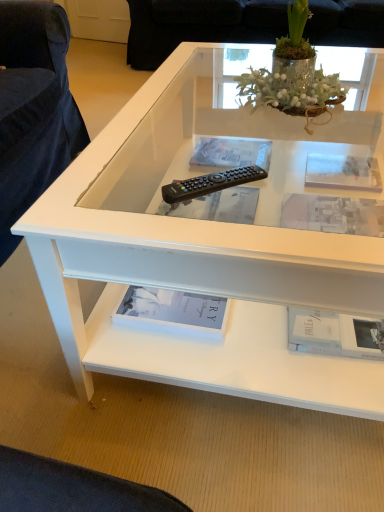
The height and width of the screenshot is (512, 384). What do you see at coordinates (232, 152) in the screenshot?
I see `clear plastic book at center, marked as the first book in a back-to-front arrangement` at bounding box center [232, 152].

The width and height of the screenshot is (384, 512). Describe the element at coordinates (198, 272) in the screenshot. I see `white glossy coffee table at center` at that location.

The height and width of the screenshot is (512, 384). What do you see at coordinates (343, 172) in the screenshot?
I see `transparent glass frame at upper center` at bounding box center [343, 172].

What do you see at coordinates (333, 214) in the screenshot?
I see `white matte book at upper right, positioned as the third book in back-to-front order` at bounding box center [333, 214].

Where is `white matte book at lower right, arranged as the 1th book when viewed from the front`? The image size is (384, 512). white matte book at lower right, arranged as the 1th book when viewed from the front is located at coordinates (334, 334).

Is clear plastic book at center, which is counted as the 5th book, starting from the front, inside the boundaries of matte black remote control at center, positioned as the 4th book in front-to-back order, or outside?

clear plastic book at center, which is counted as the 5th book, starting from the front, is not inside matte black remote control at center, positioned as the 4th book in front-to-back order, it's outside.

From the image's perspective, is clear plastic book at center, marked as the first book in a back-to-front arrangement, under matte black remote control at center, positioned as the 4th book in front-to-back order?

Actually, clear plastic book at center, marked as the first book in a back-to-front arrangement, appears above matte black remote control at center, positioned as the 4th book in front-to-back order, in the image.

Which object is wider, clear plastic book at center, which is counted as the 5th book, starting from the front, or matte black remote control at center, which is the second book in back-to-front order?

matte black remote control at center, which is the second book in back-to-front order, is wider.

From a real-world perspective, relative to matte black remote control at center, which is the second book in back-to-front order, is clear plastic book at center, marked as the first book in a back-to-front arrangement, vertically above or below?

From a real-world perspective, clear plastic book at center, marked as the first book in a back-to-front arrangement, is physically above matte black remote control at center, which is the second book in back-to-front order.

Which is correct: white paper book at lower center, positioned as the second book in front-to-back order, is inside black plastic remote control at center, or outside of it?

white paper book at lower center, positioned as the second book in front-to-back order, is not inside black plastic remote control at center, it's outside.

From the picture: From a real-world perspective, who is located higher, white paper book at lower center, positioned as the second book in front-to-back order, or black plastic remote control at center?

From a 3D spatial view, black plastic remote control at center is above.

Is white paper book at lower center, positioned as the second book in front-to-back order, wider or thinner than black plastic remote control at center?

In the image, white paper book at lower center, positioned as the second book in front-to-back order, appears to be wider than black plastic remote control at center.

Which of these two, white matte book at upper right, acting as the 3th book starting from the front, or white glossy coffee table at center, is smaller?

Smaller between the two is white matte book at upper right, acting as the 3th book starting from the front.

From a real-world perspective, is white matte book at upper right, positioned as the third book in back-to-front order, located beneath white glossy coffee table at center?

Incorrect, from a real-world perspective, white matte book at upper right, positioned as the third book in back-to-front order, is higher than white glossy coffee table at center.

From the picture: Is white glossy coffee table at center surrounded by white matte book at upper right, positioned as the third book in back-to-front order?

No, white glossy coffee table at center is not a part of white matte book at upper right, positioned as the third book in back-to-front order.

In the scene shown: Is green glass vase at upper center turned away from white paper book at lower center, the 4th book positioned from the back?

green glass vase at upper center does not have its back to white paper book at lower center, the 4th book positioned from the back.

Which point is more forward, (x=276, y=39) or (x=216, y=317)?

Positioned in front is point (x=216, y=317).

Considering the relative positions of green glass vase at upper center and white paper book at lower center, positioned as the second book in front-to-back order, in the image provided, is green glass vase at upper center to the left or to the right of white paper book at lower center, positioned as the second book in front-to-back order,?

Based on their positions, green glass vase at upper center is located to the right of white paper book at lower center, positioned as the second book in front-to-back order.

Considering the sizes of green glass vase at upper center and white paper book at lower center, the 4th book positioned from the back, in the image, is green glass vase at upper center taller or shorter than white paper book at lower center, the 4th book positioned from the back,?

In the image, green glass vase at upper center appears to be taller than white paper book at lower center, the 4th book positioned from the back.

Is green glass vase at upper center at the back of transparent glass frame at upper center?

No, green glass vase at upper center is not at the back of transparent glass frame at upper center.

Can you tell me how much transparent glass frame at upper center and green glass vase at upper center differ in facing direction?

There is a 88.5-degree angle between the facing directions of transparent glass frame at upper center and green glass vase at upper center.

Who is bigger, transparent glass frame at upper center or green glass vase at upper center?

With larger size is green glass vase at upper center.

Which object is thinner, transparent glass frame at upper center or green glass vase at upper center?

With smaller width is transparent glass frame at upper center.

Are white matte book at lower right, the 5th book when ordered from back to front, and black plastic remote control at center making contact?

white matte book at lower right, the 5th book when ordered from back to front, and black plastic remote control at center are not in contact.

Can you confirm if white matte book at lower right, the 5th book when ordered from back to front, is thinner than black plastic remote control at center?

In fact, white matte book at lower right, the 5th book when ordered from back to front, might be wider than black plastic remote control at center.

Can you confirm if white matte book at lower right, arranged as the 1th book when viewed from the front, is bigger than black plastic remote control at center?

Indeed, white matte book at lower right, arranged as the 1th book when viewed from the front, has a larger size compared to black plastic remote control at center.

In terms of height, does white matte book at lower right, the 5th book when ordered from back to front, look taller or shorter compared to black plastic remote control at center?

white matte book at lower right, the 5th book when ordered from back to front, is taller than black plastic remote control at center.

Does white paper book at lower center, positioned as the second book in front-to-back order, have a larger size compared to white matte book at lower right, the 5th book when ordered from back to front?

Yes, white paper book at lower center, positioned as the second book in front-to-back order, is bigger than white matte book at lower right, the 5th book when ordered from back to front.

Is the position of white paper book at lower center, the 4th book positioned from the back, less distant than that of white matte book at lower right, arranged as the 1th book when viewed from the front?

No, white paper book at lower center, the 4th book positioned from the back, is further to the viewer.

Which is more to the left, white paper book at lower center, the 4th book positioned from the back, or white matte book at lower right, arranged as the 1th book when viewed from the front?

Positioned to the left is white paper book at lower center, the 4th book positioned from the back.

From the image's perspective, between white paper book at lower center, the 4th book positioned from the back, and white matte book at lower right, arranged as the 1th book when viewed from the front, who is located below?

white matte book at lower right, arranged as the 1th book when viewed from the front.

Which book is the 1st one when counting from the right side of the matte black remote control at center, positioned as the 4th book in front-to-back order? Please provide its 2D coordinates.

[(232, 152)]

Image resolution: width=384 pixels, height=512 pixels. I want to click on remote control in front of the white paper book at lower center, the 4th book positioned from the back, so click(210, 183).

In the scene shown: From the image, which object appears to be nearer to transparent glass frame at upper center, green glass vase at upper center or white glossy coffee table at center?

green glass vase at upper center lies closer to transparent glass frame at upper center than the other object.

Considering their positions, is white paper book at lower center, positioned as the second book in front-to-back order, positioned further to black plastic remote control at center than white matte book at upper right, acting as the 3th book starting from the front?

white matte book at upper right, acting as the 3th book starting from the front.

When comparing their distances from white matte book at upper right, acting as the 3th book starting from the front, does white matte book at lower right, arranged as the 1th book when viewed from the front, or black plastic remote control at center seem closer?

white matte book at lower right, arranged as the 1th book when viewed from the front, lies closer to white matte book at upper right, acting as the 3th book starting from the front, than the other object.

Looking at the image, which one is located further to matte black remote control at center, positioned as the 4th book in front-to-back order, white matte book at lower right, the 5th book when ordered from back to front, or white matte book at upper right, acting as the 3th book starting from the front?

white matte book at lower right, the 5th book when ordered from back to front.

Consider the image. Which object lies nearer to the anchor point white paper book at lower center, positioned as the second book in front-to-back order, clear plastic book at center, which is counted as the 5th book, starting from the front, or transparent glass frame at upper center?

transparent glass frame at upper center is closer to white paper book at lower center, positioned as the second book in front-to-back order.

Estimate the real-world distances between objects in this image. Which object is further from clear plastic book at center, marked as the first book in a back-to-front arrangement, white paper book at lower center, positioned as the second book in front-to-back order, or matte black remote control at center, positioned as the 4th book in front-to-back order?

white paper book at lower center, positioned as the second book in front-to-back order.

Based on their spatial positions, is black plastic remote control at center or white matte book at lower right, the 5th book when ordered from back to front, closer to green glass vase at upper center?

black plastic remote control at center lies closer to green glass vase at upper center than the other object.

From the image, which object appears to be farther from white paper book at lower center, positioned as the second book in front-to-back order, white matte book at upper right, acting as the 3th book starting from the front, or black plastic remote control at center?

Based on the image, white matte book at upper right, acting as the 3th book starting from the front, appears to be further to white paper book at lower center, positioned as the second book in front-to-back order.

Where is `houseplant between white glossy coffee table at center and clear plastic book at center, marked as the first book in a back-to-front arrangement, from front to back`? houseplant between white glossy coffee table at center and clear plastic book at center, marked as the first book in a back-to-front arrangement, from front to back is located at coordinates (291, 72).

This screenshot has width=384, height=512. In order to click on square located between black plastic remote control at center and clear plastic book at center, marked as the first book in a back-to-front arrangement, in the depth direction in this screenshot , I will do `click(343, 172)`.

At what (x,y) coordinates should I click in order to perform the action: click on remote control between green glass vase at upper center and white paper book at lower center, the 4th book positioned from the back, in the vertical direction. Please return your answer as a coordinate pair (x, y). Looking at the image, I should click on (210, 183).

At what (x,y) coordinates should I click in order to perform the action: click on remote control between white glossy coffee table at center and white matte book at upper right, acting as the 3th book starting from the front, in the up-down direction. Please return your answer as a coordinate pair (x, y). Looking at the image, I should click on (210, 183).